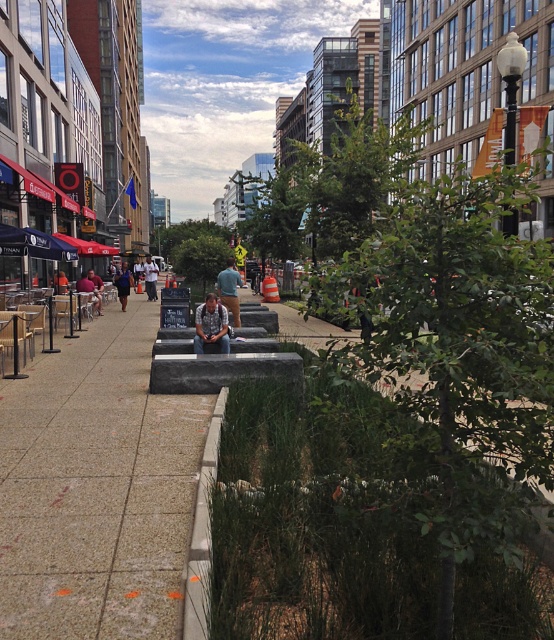
Who is positioned more to the left, dark gray concrete bench at center or dark blue jeans at center?

Positioned to the left is dark blue jeans at center.

The height and width of the screenshot is (640, 554). What do you see at coordinates (211, 324) in the screenshot? I see `dark gray concrete bench at center` at bounding box center [211, 324].

This screenshot has width=554, height=640. Find the location of `dark gray concrete bench at center`. dark gray concrete bench at center is located at coordinates (211, 324).

Where is `dark gray concrete bench at center`? The image size is (554, 640). dark gray concrete bench at center is located at coordinates (211, 324).

Is gray concrete bench at center taller than blue jeans at center?

In fact, gray concrete bench at center may be shorter than blue jeans at center.

Which is below, gray concrete bench at center or blue jeans at center?

Positioned lower is gray concrete bench at center.

At what (x,y) coordinates should I click in order to perform the action: click on gray concrete bench at center. Please return your answer as a coordinate pair (x, y). The image size is (554, 640). Looking at the image, I should click on (96, 488).

Is dark blue jeans at center further to the viewer compared to white cotton shirt at center?

No, dark blue jeans at center is closer to the viewer.

Can you confirm if dark blue jeans at center is thinner than white cotton shirt at center?

Incorrect, dark blue jeans at center's width is not less than white cotton shirt at center's.

You are a GUI agent. You are given a task and a screenshot of the screen. Output one action in this format:
    pyautogui.click(x=<x>, y=<y>)
    Task: Click on the dark blue jeans at center
    The height and width of the screenshot is (640, 554).
    Given the screenshot: What is the action you would take?
    pyautogui.click(x=124, y=284)